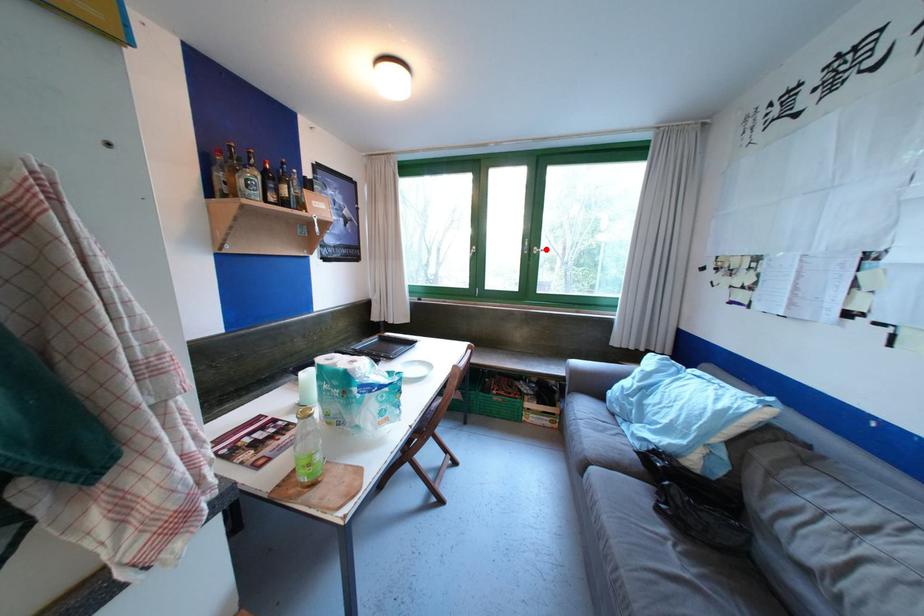
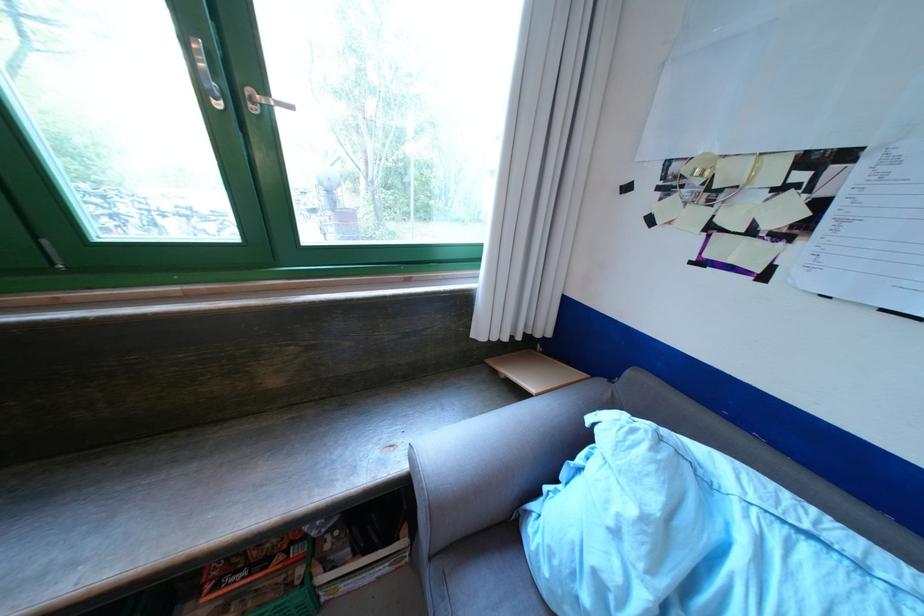
Where in the second image is the point corresponding to the highlighted location from the first image?

(272, 92)